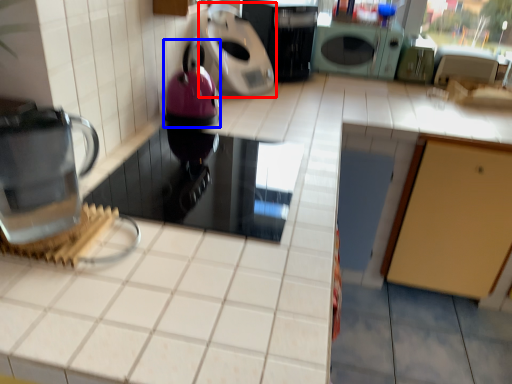
Question: Which object appears closest to the camera in this image, kitchen appliance (highlighted by a red box) or appliance (highlighted by a blue box)?

Choices:
 (A) kitchen appliance
 (B) appliance

Answer: (B)